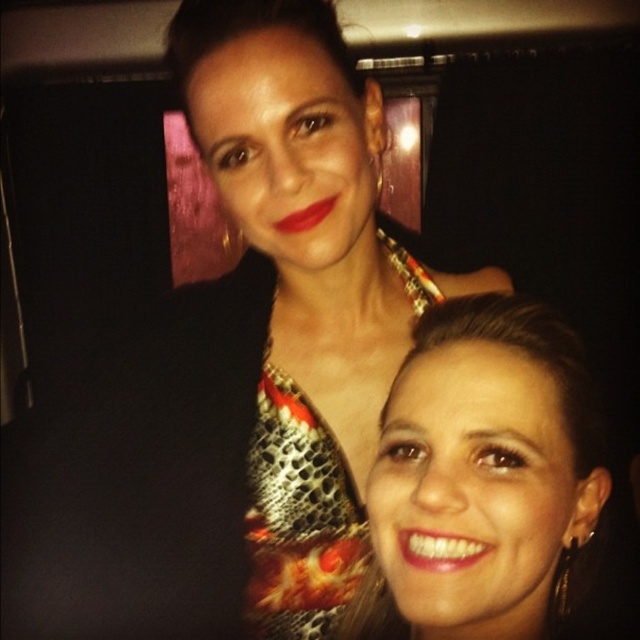
Question: Which point is closer to the camera?

Choices:
 (A) (316, 518)
 (B) (458, 552)

Answer: (B)

Question: Which point is closer to the camera?

Choices:
 (A) (268, 481)
 (B) (456, 356)

Answer: (B)

Question: Can you confirm if matte gold earrings at lower right is wider than metallic snakeskin dress at center?

Choices:
 (A) no
 (B) yes

Answer: (B)

Question: Is matte gold earrings at lower right wider than metallic snakeskin dress at center?

Choices:
 (A) yes
 (B) no

Answer: (A)

Question: Is matte gold earrings at lower right to the right of metallic snakeskin dress at center from the viewer's perspective?

Choices:
 (A) no
 (B) yes

Answer: (B)